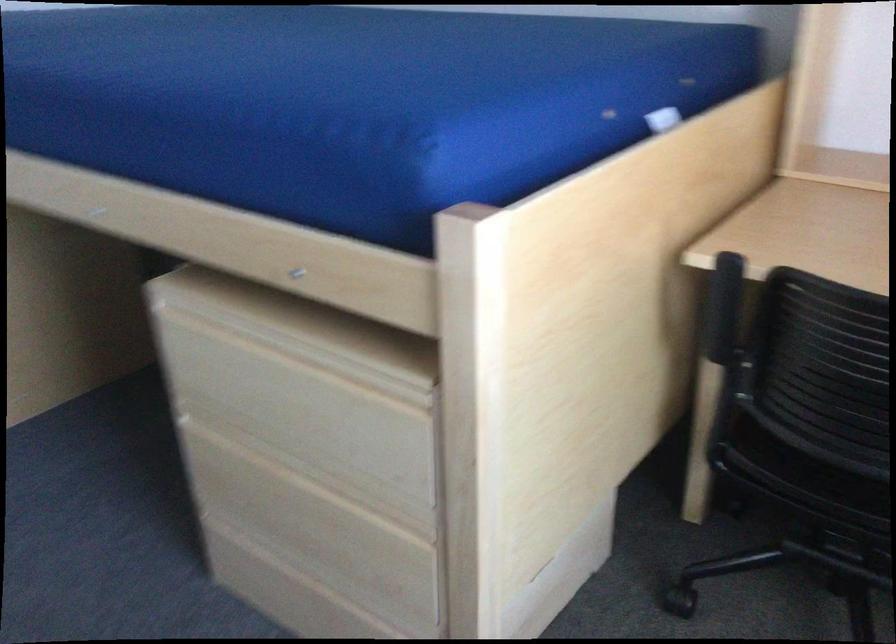
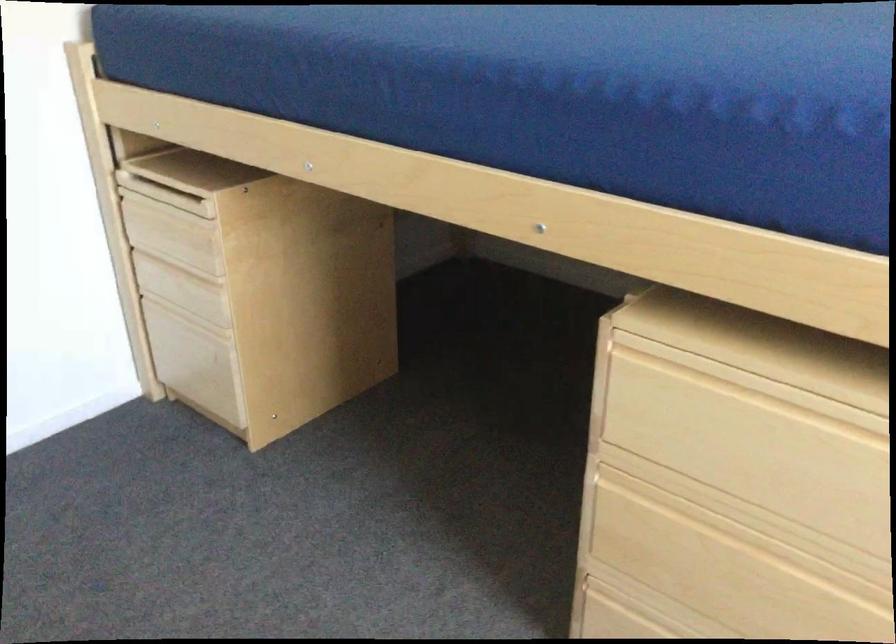
Question: The camera is either moving clockwise (left) or counter-clockwise (right) around the object. The first image is from the beginning of the video and the second image is from the end. Is the camera moving left or right when shooting the video?

Choices:
 (A) Left
 (B) Right

Answer: (B)